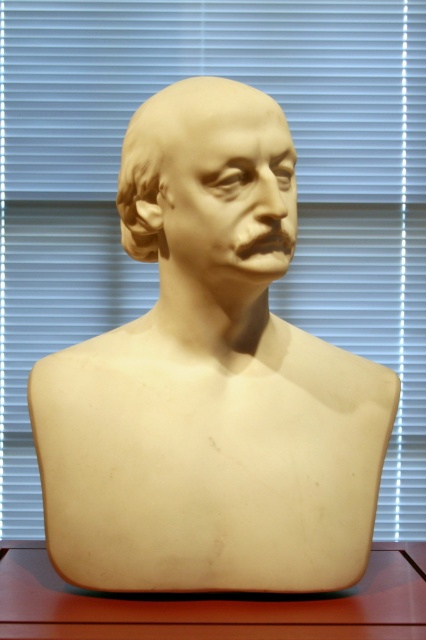
You are an art conservator examining the matte beige bust at center and the matte wood table at center. Which object is directly above the other?

The matte beige bust at center is positioned over the matte wood table at center, so the bust is directly above the table.

You are an art conservator examining a sculpture in a gallery. You notice a point at coordinates (210,381). What object is located at that point?

The white marble bust at center is located at point (210,381).